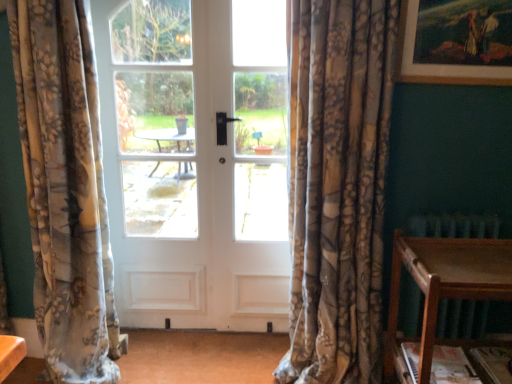
Question: Is wooden picture frame at upper right smaller than floral fabric curtain at left, the second curtain from the right?

Choices:
 (A) yes
 (B) no

Answer: (A)

Question: From the image's perspective, would you say wooden picture frame at upper right is shown under floral fabric curtain at left, the second curtain from the right?

Choices:
 (A) yes
 (B) no

Answer: (B)

Question: Is wooden picture frame at upper right shorter than floral fabric curtain at left, the 1th curtain viewed from the left?

Choices:
 (A) yes
 (B) no

Answer: (A)

Question: From a real-world perspective, is wooden picture frame at upper right over floral fabric curtain at left, the second curtain from the right?

Choices:
 (A) no
 (B) yes

Answer: (B)

Question: Is wooden picture frame at upper right at the left side of floral fabric curtain at left, the second curtain from the right?

Choices:
 (A) no
 (B) yes

Answer: (A)

Question: Does wooden picture frame at upper right have a greater height compared to floral fabric curtain at left, the second curtain from the right?

Choices:
 (A) no
 (B) yes

Answer: (A)

Question: Can you confirm if white matte door at center is smaller than wooden picture frame at upper right?

Choices:
 (A) yes
 (B) no

Answer: (B)

Question: From a real-world perspective, is white matte door at center positioned under wooden picture frame at upper right based on gravity?

Choices:
 (A) yes
 (B) no

Answer: (A)

Question: Is white matte door at center positioned with its back to wooden picture frame at upper right?

Choices:
 (A) yes
 (B) no

Answer: (B)

Question: Does white matte door at center appear on the right side of wooden picture frame at upper right?

Choices:
 (A) yes
 (B) no

Answer: (B)

Question: Is white matte door at center further to camera compared to wooden picture frame at upper right?

Choices:
 (A) yes
 (B) no

Answer: (A)

Question: Is white matte door at center in front of wooden picture frame at upper right?

Choices:
 (A) yes
 (B) no

Answer: (B)

Question: Can you confirm if white matte door at center is positioned to the right of floral fabric curtain at left, the second curtain from the right?

Choices:
 (A) no
 (B) yes

Answer: (B)